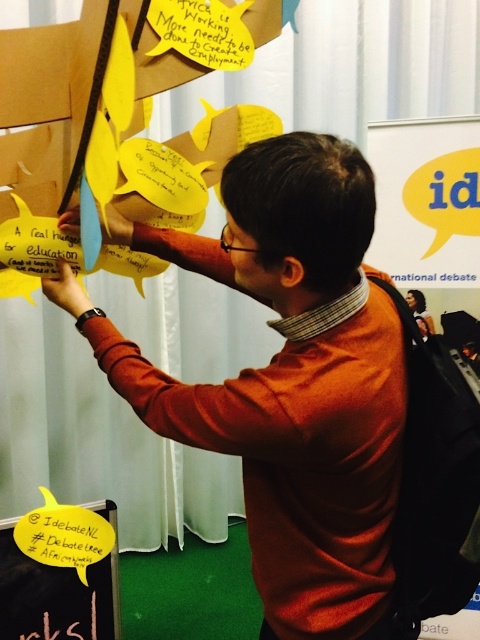
Is orange sweater at center positioned at the back of yellow paper at upper left?

No.

From the picture: Is orange sweater at center in front of yellow paper at upper left?

Yes, orange sweater at center is in front of yellow paper at upper left.

Does point (183, 406) come in front of point (28, 593)?

Yes, point (183, 406) is closer to viewer.

At what (x,y) coordinates should I click in order to perform the action: click on orange sweater at center. Please return your answer as a coordinate pair (x, y). This screenshot has width=480, height=640. Looking at the image, I should click on (289, 381).

Is yellow paper at upper left positioned in front of black chalkboard at lower left?

Yes.

Does yellow paper at upper left have a larger size compared to black chalkboard at lower left?

Correct, yellow paper at upper left is larger in size than black chalkboard at lower left.

Between point (119, 628) and point (74, 602), which one is positioned behind?

Positioned behind is point (119, 628).

The height and width of the screenshot is (640, 480). In order to click on yellow paper at upper left in this screenshot , I will do `click(55, 596)`.

Who is higher up, orange sweater at center or black chalkboard at lower left?

orange sweater at center is higher up.

I want to click on orange sweater at center, so click(289, 381).